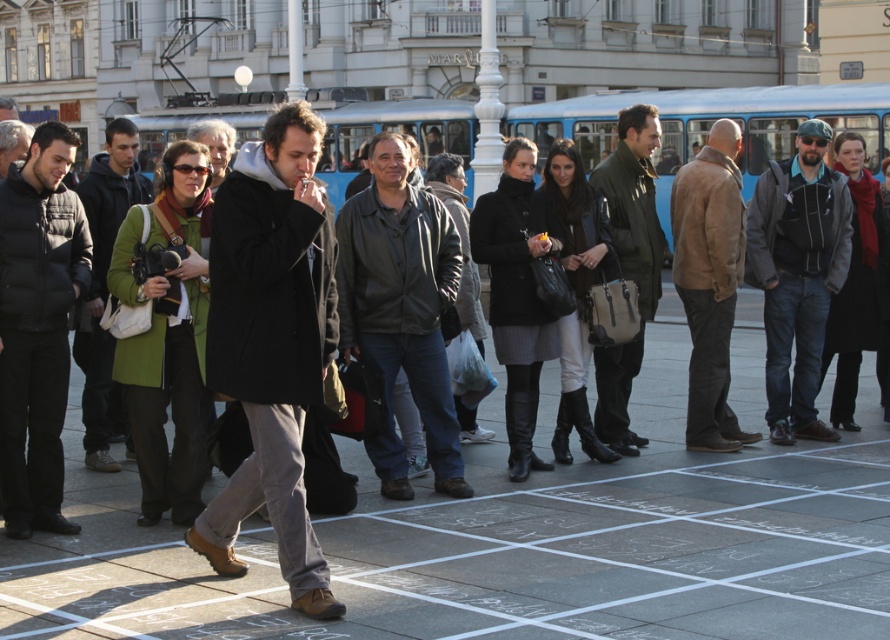
Which is above, leather jacket at center or black puffer jacket at left?

Positioned higher is leather jacket at center.

Which is behind, point (441, 237) or point (59, 328)?

Positioned behind is point (441, 237).

What are the coordinates of `leather jacket at center` in the screenshot? It's located at (401, 308).

Between dark gray wool coat at center and matte green jacket at center, which one has more height?

With more height is matte green jacket at center.

Does dark gray wool coat at center appear on the left side of matte green jacket at center?

Yes, dark gray wool coat at center is to the left of matte green jacket at center.

Who is more forward, [263,330] or [656,244]?

Point [263,330] is more forward.

This screenshot has width=890, height=640. Identify the location of dark gray wool coat at center. (272, 342).

Is point (797, 211) closer to camera compared to point (651, 168)?

Yes, point (797, 211) is in front of point (651, 168).

Does dark gray leather jacket at right have a lesser height compared to matte green jacket at center?

Yes, dark gray leather jacket at right is shorter than matte green jacket at center.

What do you see at coordinates (797, 275) in the screenshot?
I see `dark gray leather jacket at right` at bounding box center [797, 275].

Locate an element on the screen. The width and height of the screenshot is (890, 640). dark gray leather jacket at right is located at coordinates (797, 275).